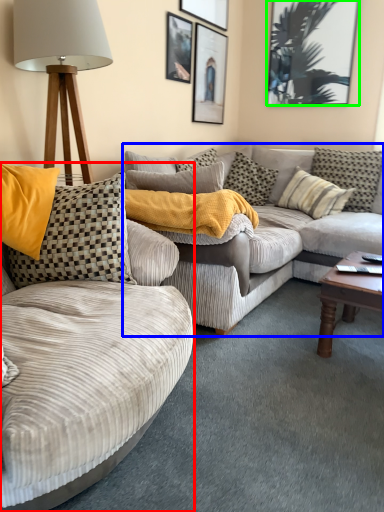
Question: Which object is the closest to the studio couch (highlighted by a red box)? Choose among these: studio couch (highlighted by a blue box) or picture frame (highlighted by a green box).

Choices:
 (A) studio couch
 (B) picture frame

Answer: (A)